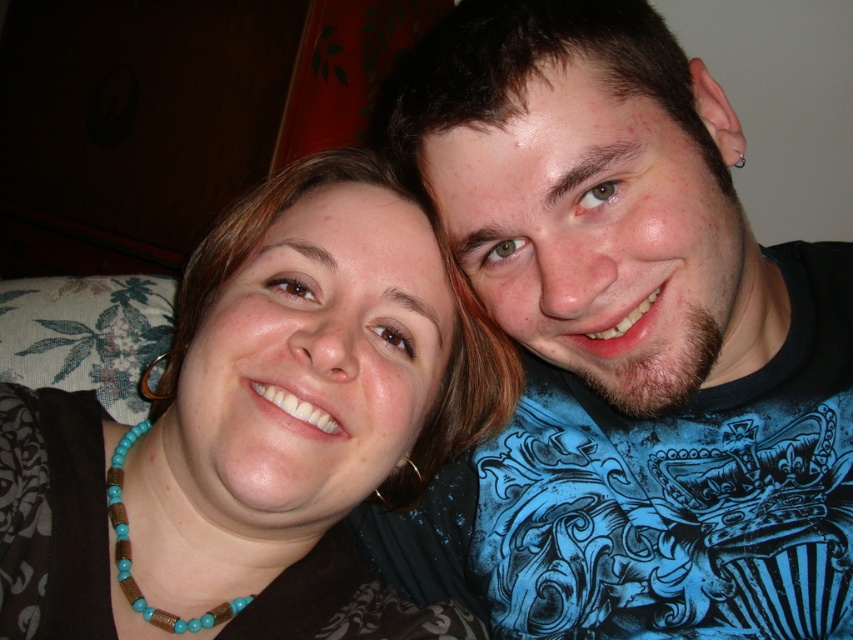
Between brown fabric at center and turquoise wood beads at lower center, which one has less height?

turquoise wood beads at lower center is shorter.

Between brown fabric at center and turquoise wood beads at lower center, which one is positioned higher?

brown fabric at center

Where is `brown fabric at center`? The height and width of the screenshot is (640, 853). brown fabric at center is located at coordinates (258, 429).

Can you confirm if blue printed shirt at right is positioned below brown fabric at center?

Incorrect, blue printed shirt at right is not positioned below brown fabric at center.

Locate an element on the screen. The height and width of the screenshot is (640, 853). blue printed shirt at right is located at coordinates (624, 346).

Locate an element on the screen. The image size is (853, 640). blue printed shirt at right is located at coordinates coord(624,346).